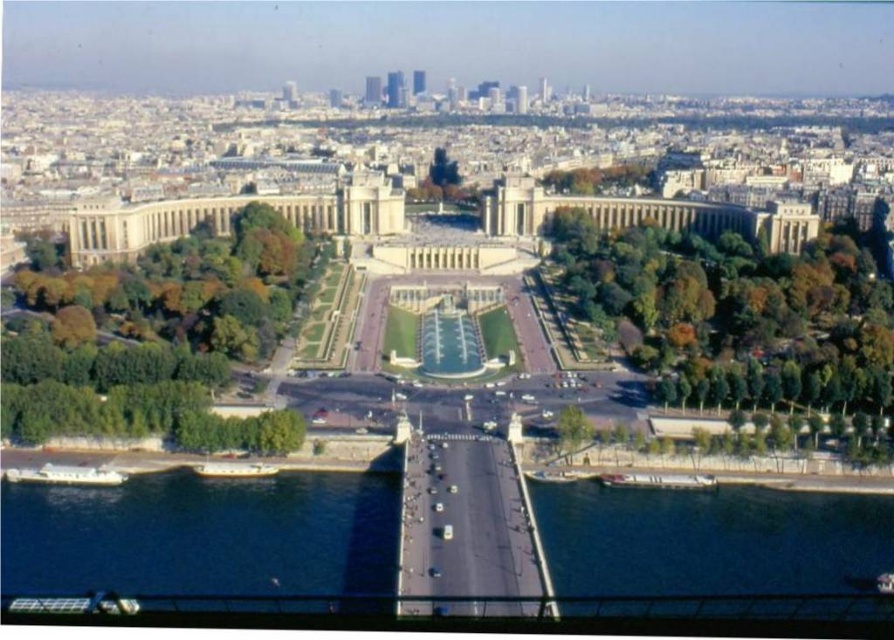
Question: Is blue glassy water at lower left smaller than dark blue water at lower right?

Choices:
 (A) yes
 (B) no

Answer: (B)

Question: Considering the relative positions of dark blue water at lower right and green glass water at center in the image provided, where is dark blue water at lower right located with respect to green glass water at center?

Choices:
 (A) below
 (B) above

Answer: (A)

Question: Considering the real-world distances, which object is farthest from the dark blue water at lower right?

Choices:
 (A) blue glassy water at lower left
 (B) green glass water at center

Answer: (B)

Question: Among these objects, which one is nearest to the camera?

Choices:
 (A) blue glassy water at lower left
 (B) green glass water at center
 (C) dark blue water at lower right

Answer: (C)

Question: Does dark blue water at lower right have a greater width compared to green glass water at center?

Choices:
 (A) no
 (B) yes

Answer: (B)

Question: Which point is farther from the camera taking this photo?

Choices:
 (A) (344, 476)
 (B) (473, 355)
 (C) (752, 524)

Answer: (B)